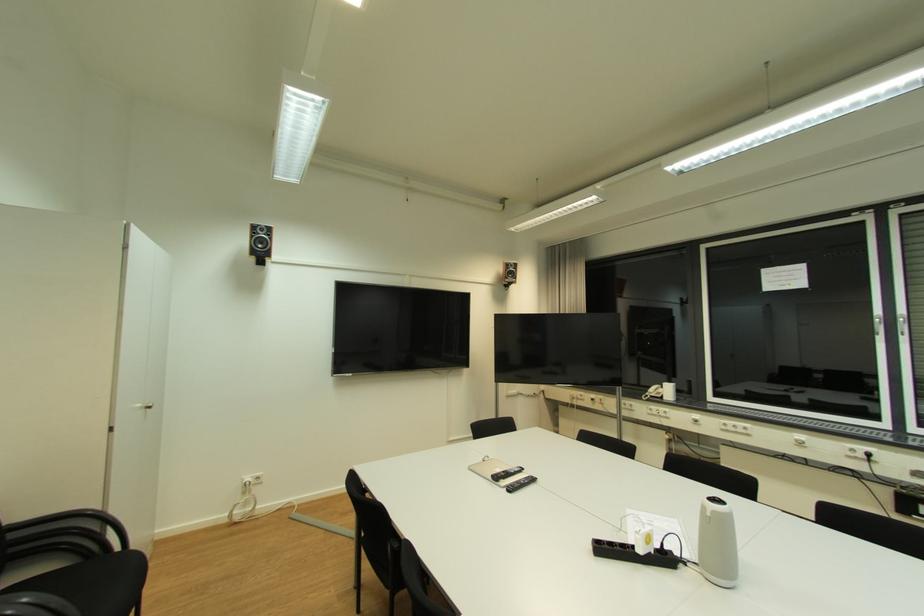
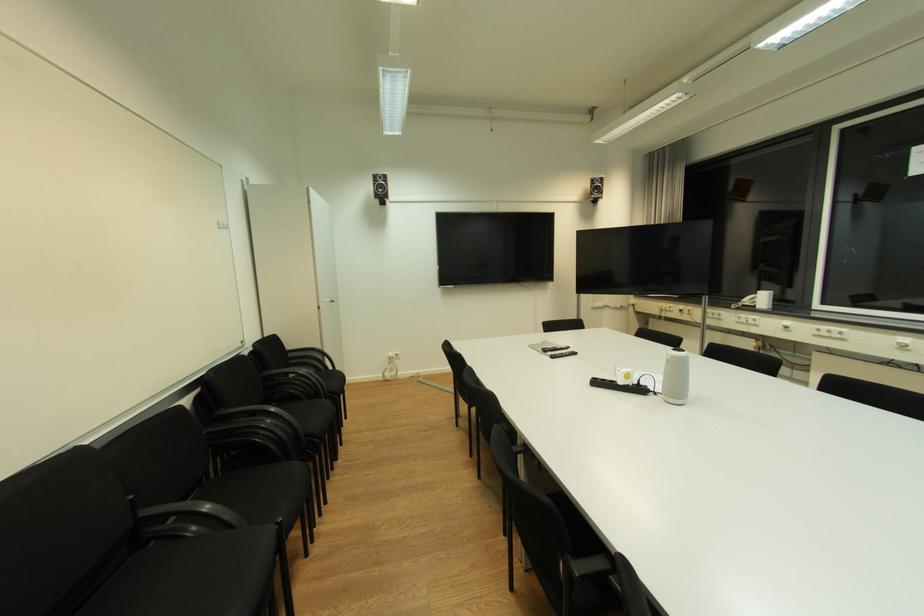
Find the pixel in the second image that matches point (667, 545) in the first image.

(645, 381)